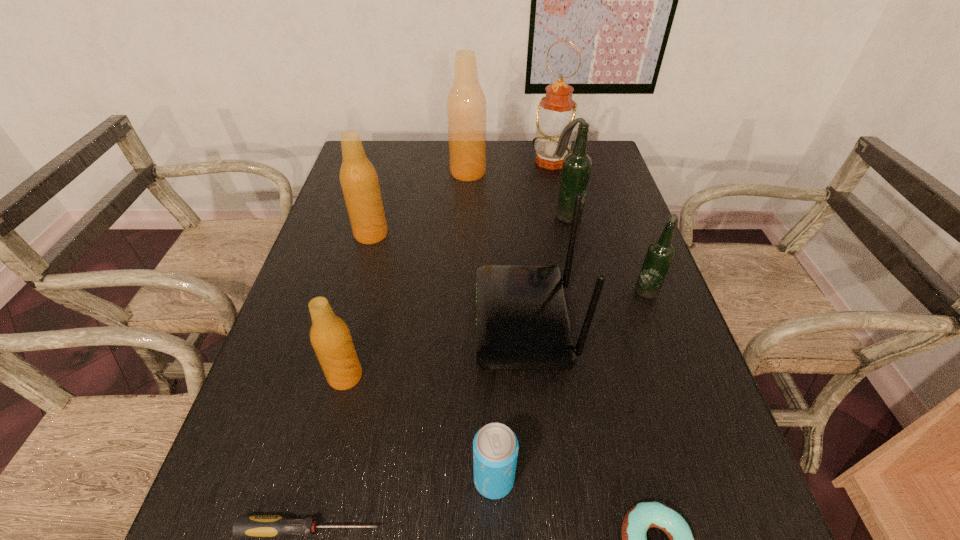
You are a GUI agent. You are given a task and a screenshot of the screen. Output one action in this format:
    pyautogui.click(x=<x>, y=<y>)
    Task: Click on the smallest tan beer bottle
    The width and height of the screenshot is (960, 540).
    Given the screenshot: What is the action you would take?
    pyautogui.click(x=330, y=337)

At what (x,y) coordinates should I click in order to perform the action: click on the eighth farthest object. Please return your answer as a coordinate pair (x, y). Looking at the image, I should click on (495, 446).

Where is `the eighth tallest object`? Image resolution: width=960 pixels, height=540 pixels. the eighth tallest object is located at coordinates (495, 446).

Identify the location of free space located on the front of the oil lamp. This screenshot has height=540, width=960. (566, 236).

Find the location of `vacant space located on the left of the biggest tan beer bottle`. vacant space located on the left of the biggest tan beer bottle is located at coordinates (408, 172).

Locate an element on the screen. The image size is (960, 540). free region located 0.240m on the left of the fourth beer bottle from left to right is located at coordinates 465,216.

Find the location of `vacant space located 0.190m on the back of the second nearest tan beer bottle`. vacant space located 0.190m on the back of the second nearest tan beer bottle is located at coordinates (384, 186).

Identify the location of vacant space located 0.050m on the front-facing side of the router. The image size is (960, 540). (454, 322).

Find the location of a particular element. The width and height of the screenshot is (960, 540). vacant area situated 0.310m on the front-facing side of the router is located at coordinates (341, 322).

This screenshot has width=960, height=540. I want to click on free space located on the front-facing side of the router, so click(315, 322).